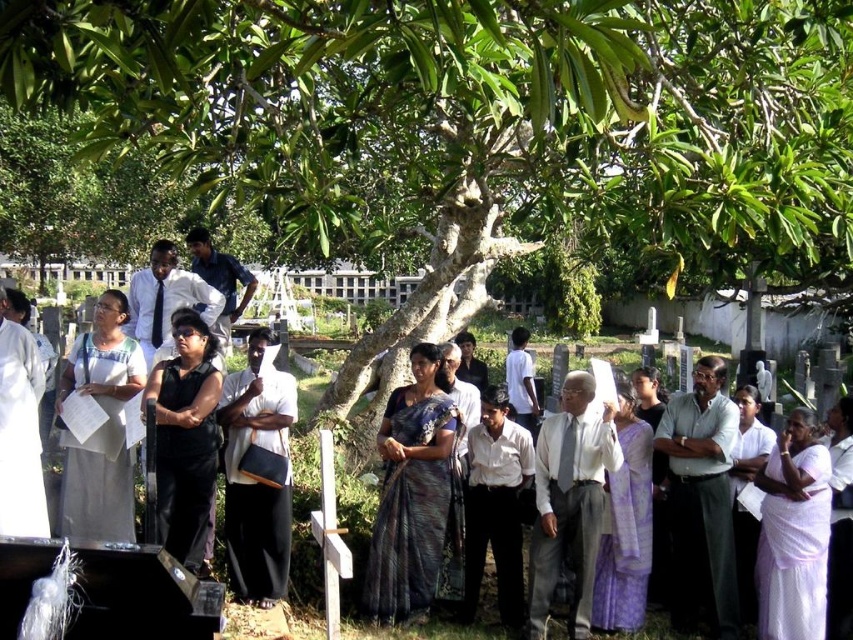
Question: Which object appears closest to the camera in this image?

Choices:
 (A) dark blue shirt at center
 (B) light gray shirt at center
 (C) dark purple silk saree at center
 (D) light gray fabric shirt at center

Answer: (D)

Question: Does dark purple silk saree at center have a larger size compared to light gray fabric shirt at center?

Choices:
 (A) yes
 (B) no

Answer: (A)

Question: Can you confirm if dark purple silk saree at center is bigger than light gray fabric shirt at center?

Choices:
 (A) yes
 (B) no

Answer: (A)

Question: Which object is farther from the camera taking this photo?

Choices:
 (A) dark purple silk saree at center
 (B) light gray shirt at center
 (C) white shirt at center
 (D) light gray fabric shirt at center

Answer: (C)

Question: Among these objects, which one is farthest from the camera?

Choices:
 (A) white shirt at center
 (B) dark blue shirt at center
 (C) light gray shirt at center

Answer: (B)

Question: Does dark purple silk saree at center appear on the left side of white shirt at center?

Choices:
 (A) no
 (B) yes

Answer: (A)